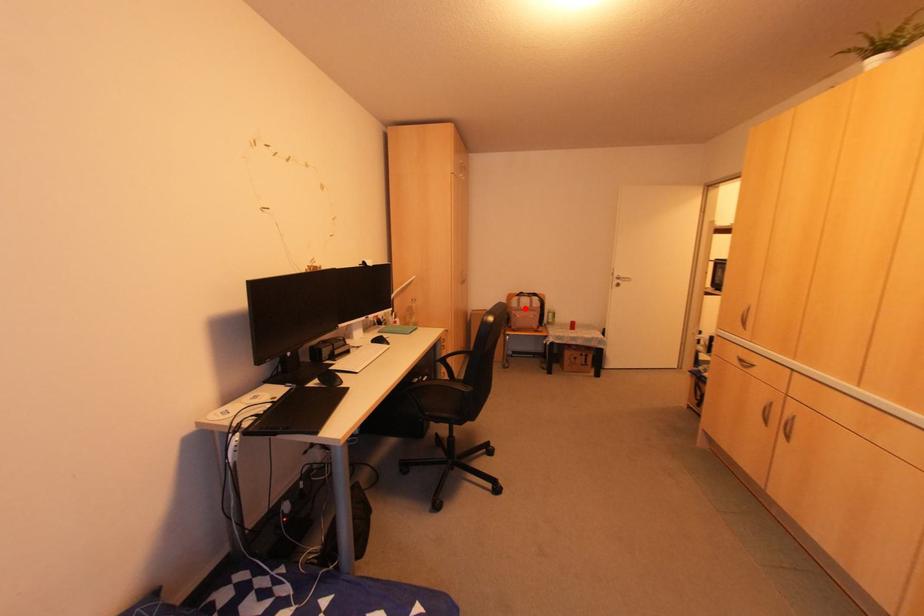
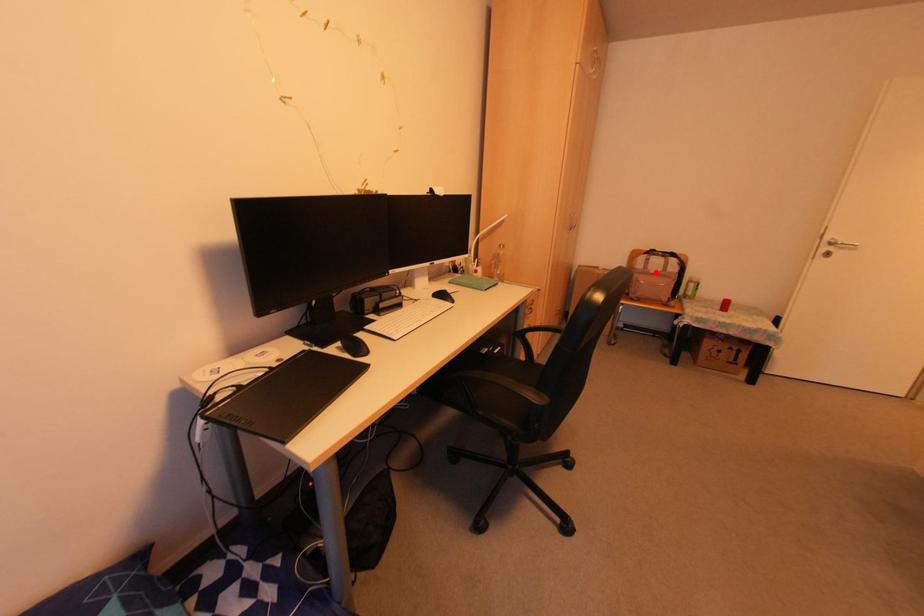
I am providing you with two images of the same scene from different viewpoints. A red point is marked on the first image and another point is marked on the second image. Do the highlighted points in image1 and image2 indicate the same real-world spot?

Yes